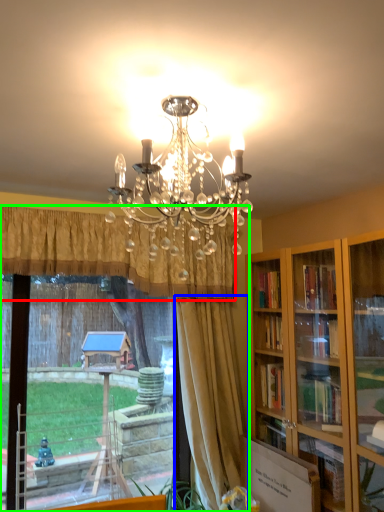
Question: Considering the real-world distances, which object is farthest from curtain (highlighted by a red box)? curtain (highlighted by a blue box) or window (highlighted by a green box)?

Choices:
 (A) curtain
 (B) window

Answer: (A)